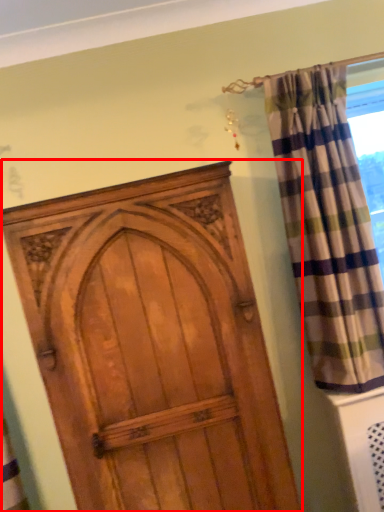
Question: From the image's perspective, considering the relative positions of door (annotated by the red box) and curtain in the image provided, where is door (annotated by the red box) located with respect to the staircase?

Choices:
 (A) below
 (B) above

Answer: (A)